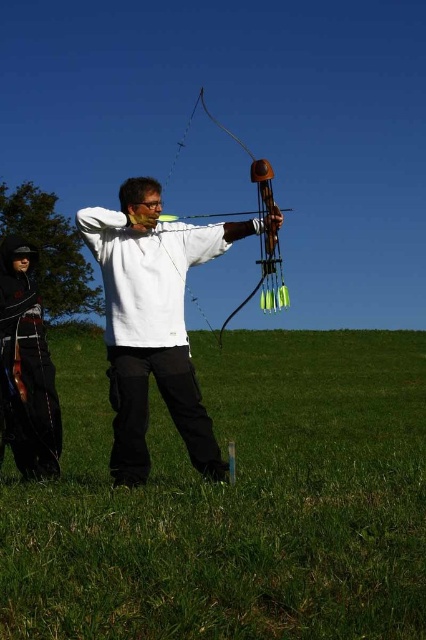
The image size is (426, 640). Find the location of `black leather jacket at lower left`. black leather jacket at lower left is located at coordinates click(25, 369).

Is green grass at center further to the viewer compared to black leather jacket at lower left?

That is False.

Between green grass at center and black leather jacket at lower left, which one has more height?

Standing taller between the two is black leather jacket at lower left.

Does point (198, 358) come behind point (0, 344)?

Yes, it is.

Find the location of a particular element. The height and width of the screenshot is (640, 426). green grass at center is located at coordinates (235, 500).

Is white matte archer at center thinner than wooden bow at center?

No.

Between white matte archer at center and wooden bow at center, which one has less height?

With less height is wooden bow at center.

Does point (199, 458) lie in front of point (265, 276)?

No, it is behind (265, 276).

Where is `white matte archer at center`? This screenshot has height=640, width=426. white matte archer at center is located at coordinates (154, 321).